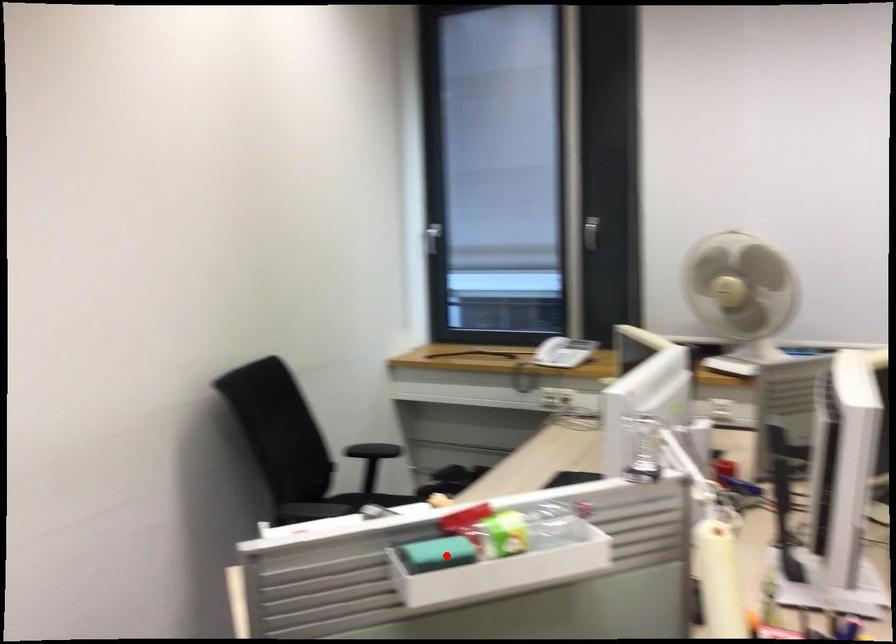
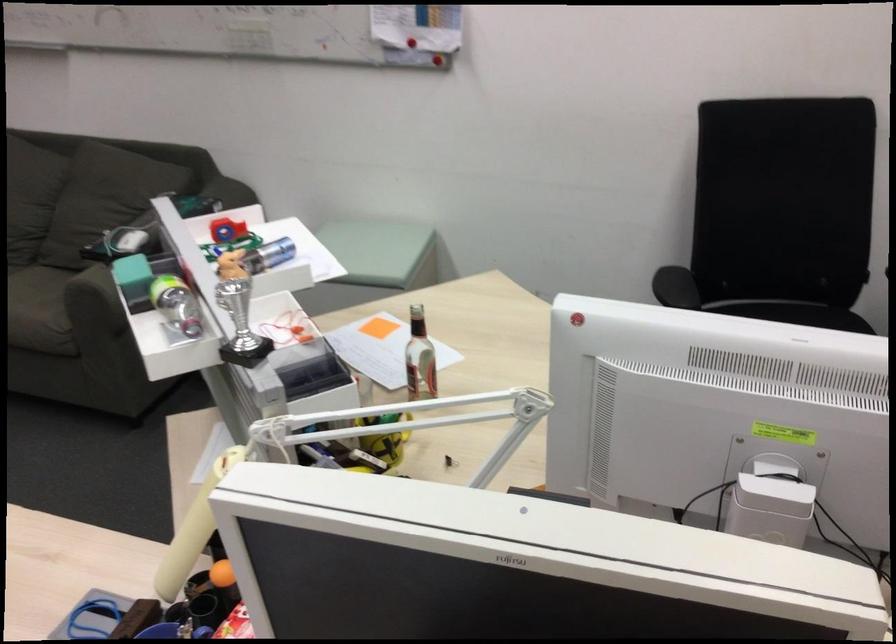
Question: I am providing you with two images of the same scene from different viewpoints. Image1 has a red point marked. In image2, the corresponding 3D location appears at what relative position? Reply with the corresponding letter.

Choices:
 (A) Closer
 (B) Farther

Answer: (B)